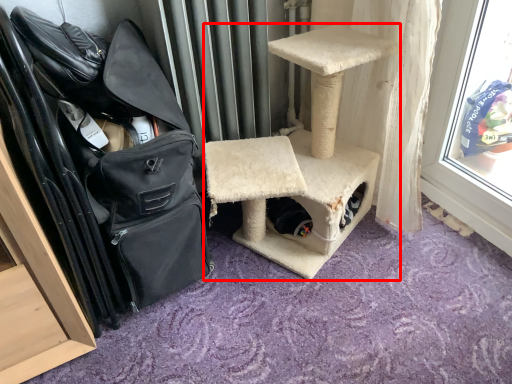
Question: Where is furniture (annotated by the red box) located in relation to shoulder bag in the image?

Choices:
 (A) right
 (B) left

Answer: (A)